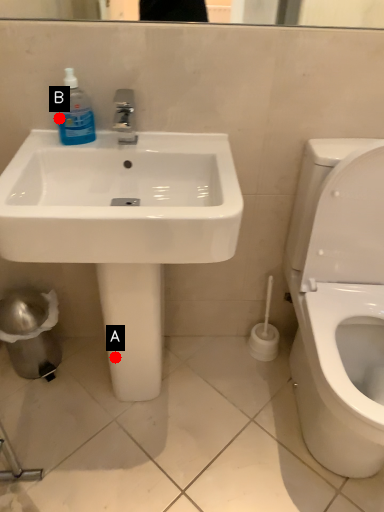
Question: Two points are circled on the image, labeled by A and B beside each circle. Which of the following is the closest to the observer?

Choices:
 (A) A is closer
 (B) B is closer

Answer: (B)